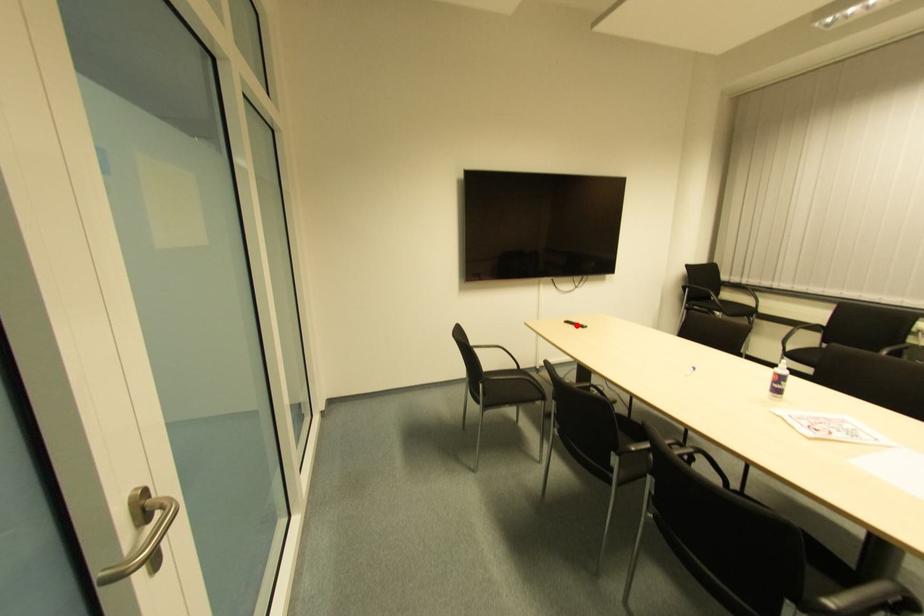
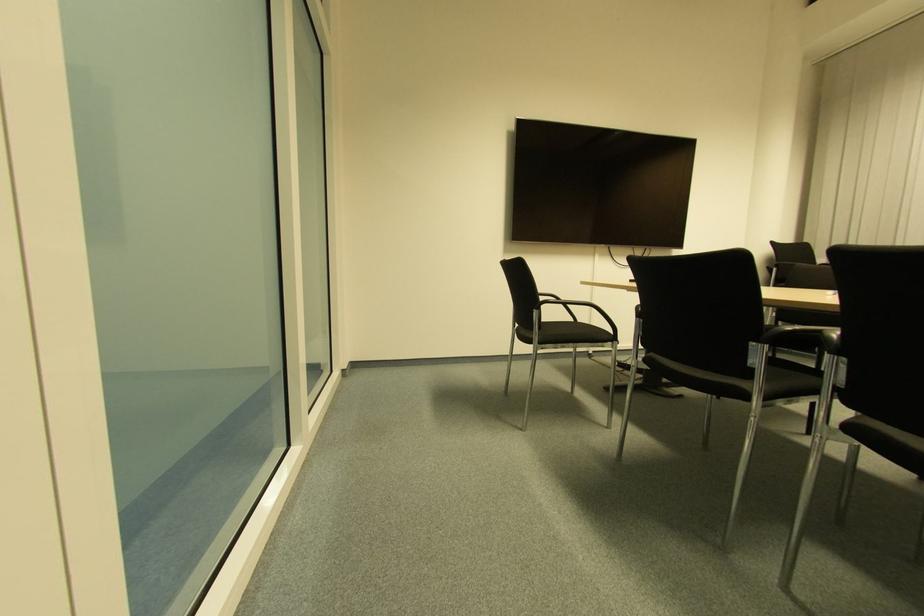
Question: I am providing you with two images of the same scene from different viewpoints. A red point is marked on the first image. Can you still see the location of the red point in image 2?

Choices:
 (A) Yes
 (B) No

Answer: (B)